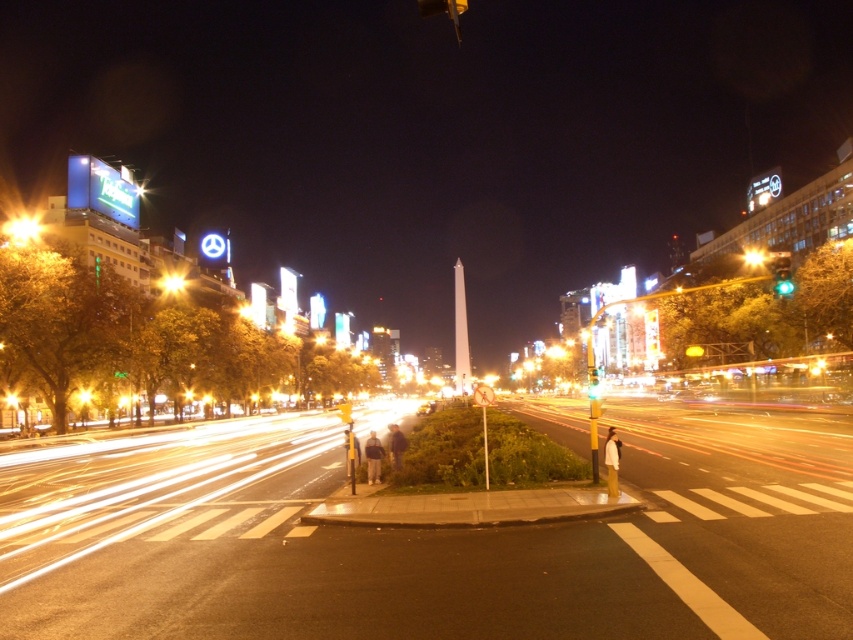
Question: Does light gray fabric pants at center have a smaller size compared to green glass traffic light at center?

Choices:
 (A) yes
 (B) no

Answer: (A)

Question: Which point appears closest to the camera in this image?

Choices:
 (A) (751, 264)
 (B) (163, 276)
 (C) (589, 392)
 (D) (33, 234)

Answer: (D)

Question: Which of the following is the closest to the observer?

Choices:
 (A) (379, 467)
 (B) (12, 221)

Answer: (A)

Question: Does light gray fabric pants at center appear under green glass traffic light at center?

Choices:
 (A) yes
 (B) no

Answer: (A)

Question: Is light brown leather jacket at center bigger than green glass traffic light at center?

Choices:
 (A) yes
 (B) no

Answer: (A)

Question: Which object appears farthest from the camera in this image?

Choices:
 (A) yellow glass traffic light at upper right
 (B) metallic billboard at upper left
 (C) green glass traffic light at center
 (D) bright yellow streetlight at center

Answer: (A)